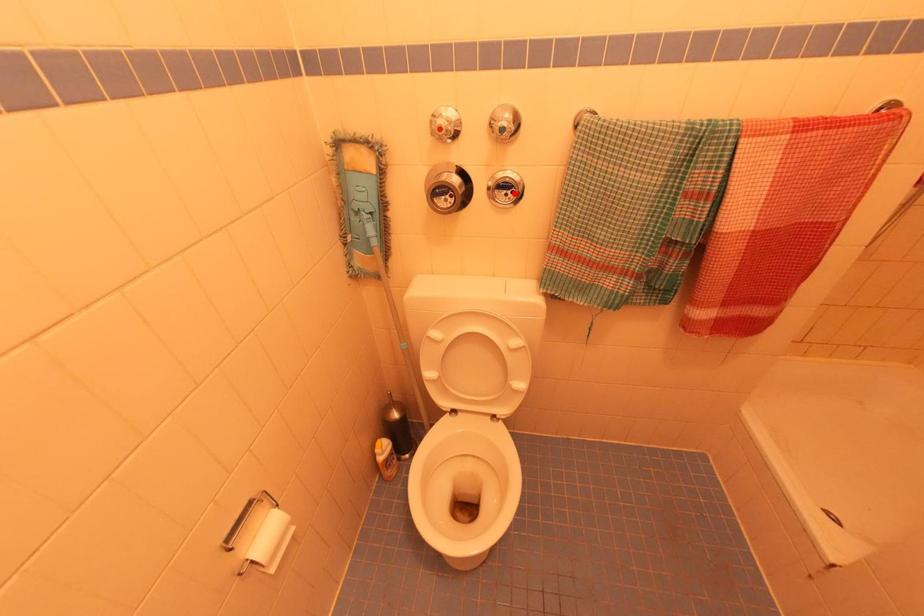
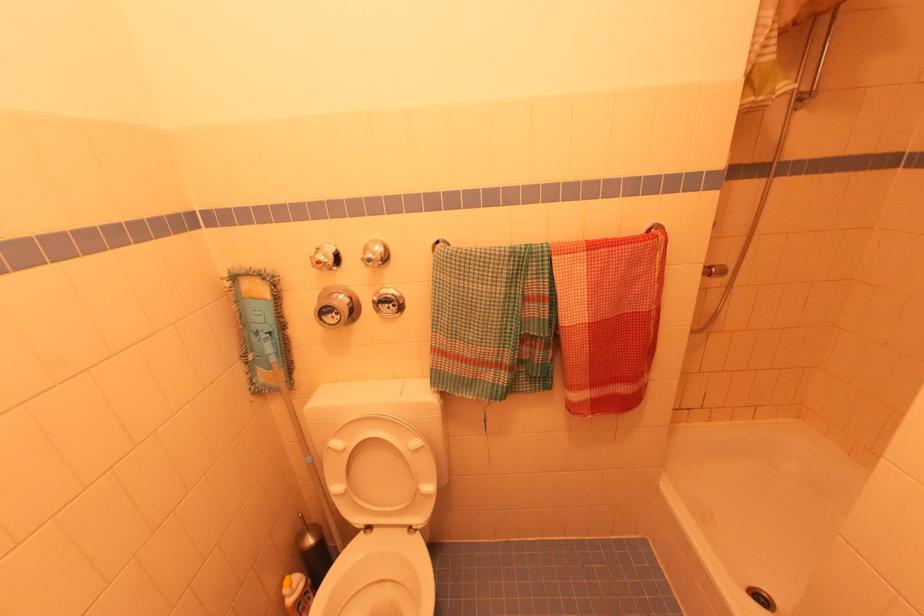
Find the pixel in the second image that matches the highlighted location in the first image.

(395, 306)